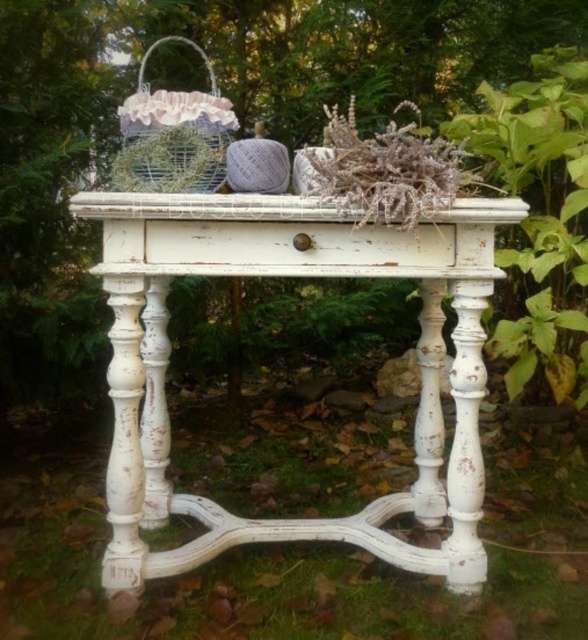
Question: Is white distressed wood table at center above metallic wire basket at upper left?

Choices:
 (A) yes
 (B) no

Answer: (B)

Question: Among these points, which one is farthest from the camera?

Choices:
 (A) click(x=205, y=182)
 (B) click(x=149, y=518)

Answer: (B)

Question: Does white distressed wood table at center have a greater width compared to metallic wire basket at upper left?

Choices:
 (A) yes
 (B) no

Answer: (A)

Question: Can you confirm if white distressed wood table at center is smaller than metallic wire basket at upper left?

Choices:
 (A) no
 (B) yes

Answer: (A)